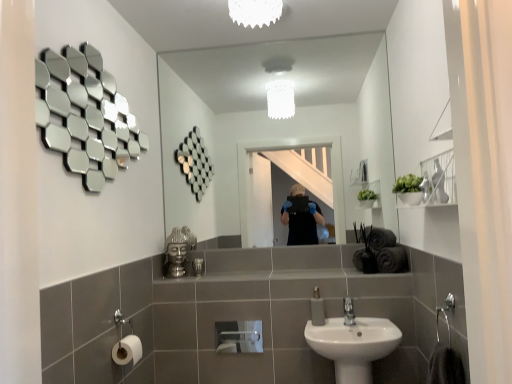
Where is `free space to the left of silver metallic faucet at lower center`? The image size is (512, 384). free space to the left of silver metallic faucet at lower center is located at coordinates (327, 324).